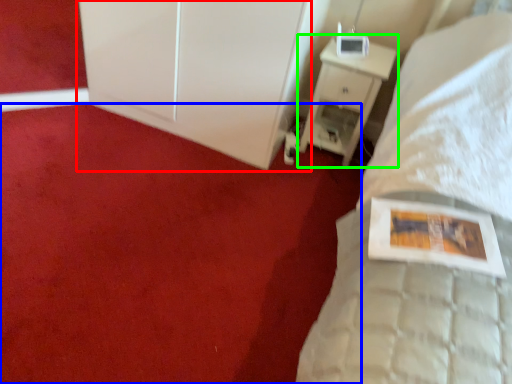
Question: Considering the real-world distances, which object is farthest from dresser (highlighted by a red box)? plain (highlighted by a blue box) or nightstand (highlighted by a green box)?

Choices:
 (A) plain
 (B) nightstand

Answer: (A)